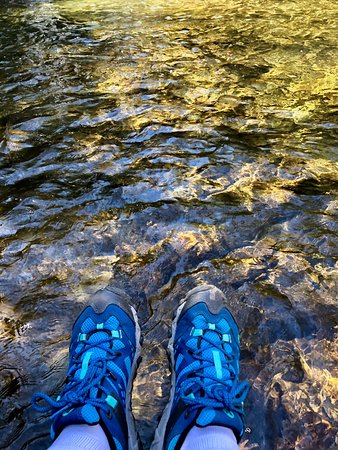
Locate an element on the screen. the left white sock is located at coordinates (266, 325), (84, 438).